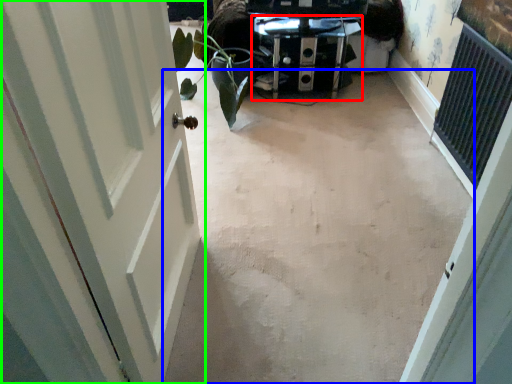
Question: Which object is the farthest from furniture (highlighted by a red box)? Choose among these: concrete (highlighted by a blue box) or door (highlighted by a green box).

Choices:
 (A) concrete
 (B) door

Answer: (B)